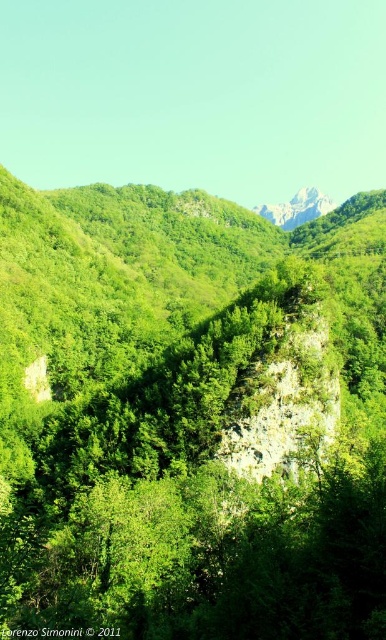
Who is lower down, green leafy tree at center or white rocky mountain at upper center?

green leafy tree at center is below.

Does point (250, 481) come in front of point (279, 204)?

Yes, point (250, 481) is closer to viewer.

Describe the element at coordinates (191, 417) in the screenshot. I see `green leafy tree at center` at that location.

Find the location of a particular element. This screenshot has width=386, height=640. green leafy tree at center is located at coordinates (x=191, y=417).